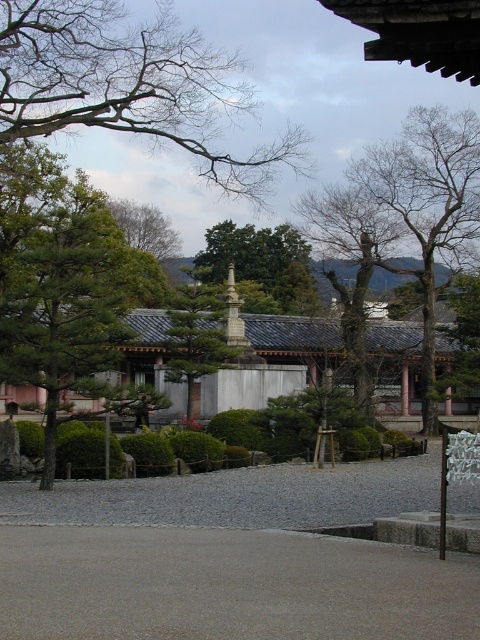
Question: Which point is closer to the camera?

Choices:
 (A) (200, 356)
 (B) (287, 525)

Answer: (B)

Question: Can you confirm if bare branches at upper left is thinner than bare wood tree at upper right?

Choices:
 (A) yes
 (B) no

Answer: (B)

Question: Is bare branches at upper left smaller than green stone statue at center?

Choices:
 (A) no
 (B) yes

Answer: (A)

Question: Which point is closer to the camera?

Choices:
 (A) (236, 349)
 (B) (409, 172)
 (C) (96, 502)
 (D) (275, 292)

Answer: (C)

Question: Considering the relative positions of bare branches at upper left and green leafy tree at center in the image provided, where is bare branches at upper left located with respect to green leafy tree at center?

Choices:
 (A) right
 (B) left

Answer: (B)

Question: Which point is closer to the camera?

Choices:
 (A) (317, 484)
 (B) (208, 365)
 (C) (423, 172)
 (D) (142, 26)

Answer: (A)